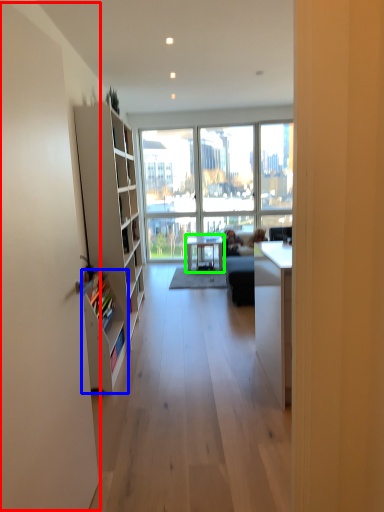
Question: Which object is the closest to the screen door (highlighted by a red box)? Choose among these: shelf (highlighted by a blue box) or table (highlighted by a green box).

Choices:
 (A) shelf
 (B) table

Answer: (A)